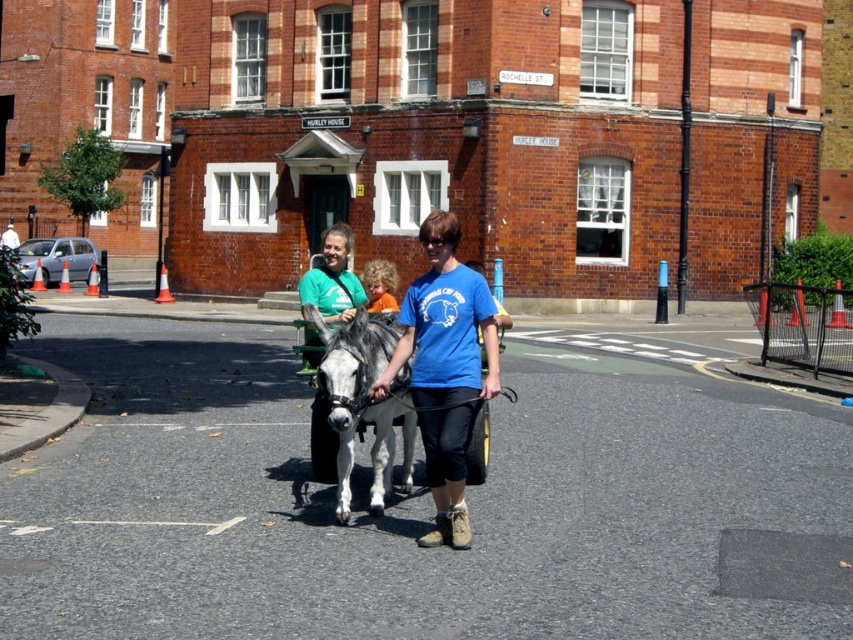
You are a pedestrian standing on the sidewalk and see the gray metallic cart at center and the curly blonde hair at center. Which object is closer to the left side of the street?

The curly blonde hair at center is closer to the left side of the street because the gray metallic cart at center is positioned on its right side.

You are a delivery person who needs to load a package onto the gray metallic cart at center. The package requires the cart to be at least 1.2 meters tall to avoid tipping over. Can the cart handle the package based on the gray matte mule at center?

The gray matte mule at center is taller than the gray metallic cart at center. Since the cart is shorter than the mule, it might not meet the 1.2 meter requirement. Therefore, the cart may not be able to safely handle the package.